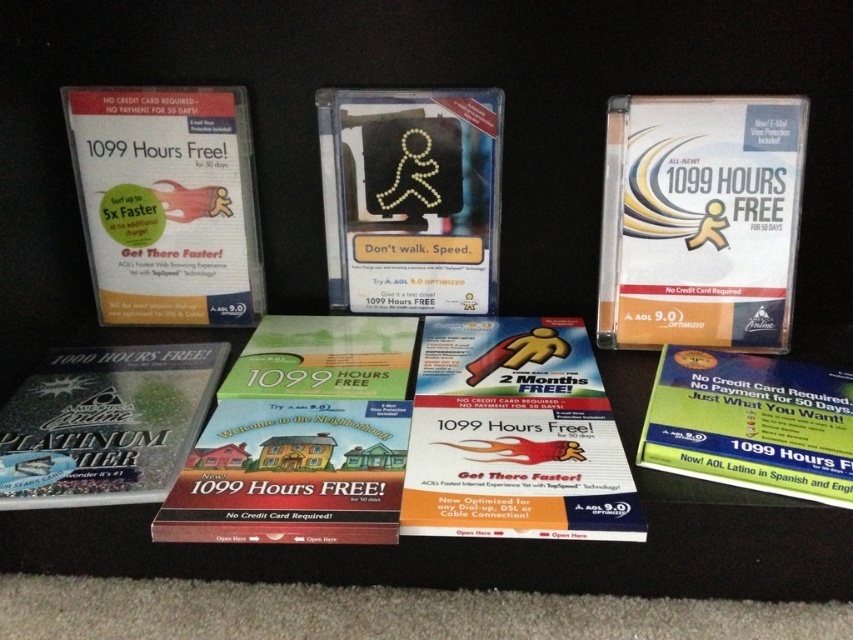
You are standing in front of the promotional materials for AOL 9.0. There is a point at coordinates point [410,198]. Where exactly is this point located?

The point [410,198] is located on the matte plastic sign at center.

You are organizing promotional materials for AOL 9.0 and notice two items on the dark surface. The matte plastic cd at upper left and the matte plastic sign at center. Which one is taller?

The matte plastic cd at upper left is taller than the matte plastic sign at center.